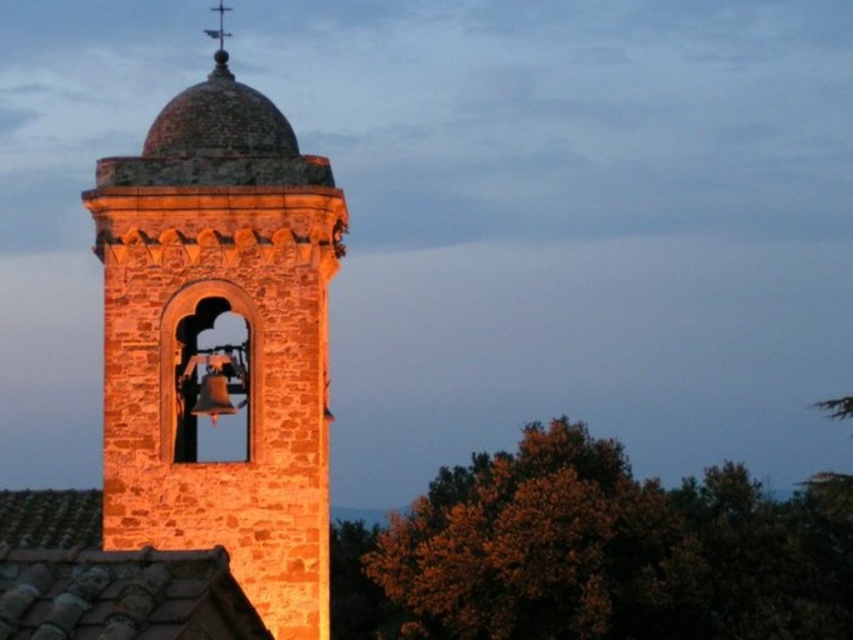
You are standing in front of the bell tower and want to know the position of the rustic stone bell tower at center relative to the polished metal spire at upper center. Which one is higher?

The polished metal spire at upper center is higher than the rustic stone bell tower at center because the rustic stone bell tower at center is below it.

You are a maintenance worker needing to climb from the rustic stone bell tower at center to the polished metal spire at upper center. Given that your ladder can extend up to 15 meters, will it be sufficient to reach the spire?

The distance between the rustic stone bell tower at center and the polished metal spire at upper center is 16.04 meters, which exceeds the ladder length of 15 meters. Therefore, the ladder is not sufficient to reach the spire.